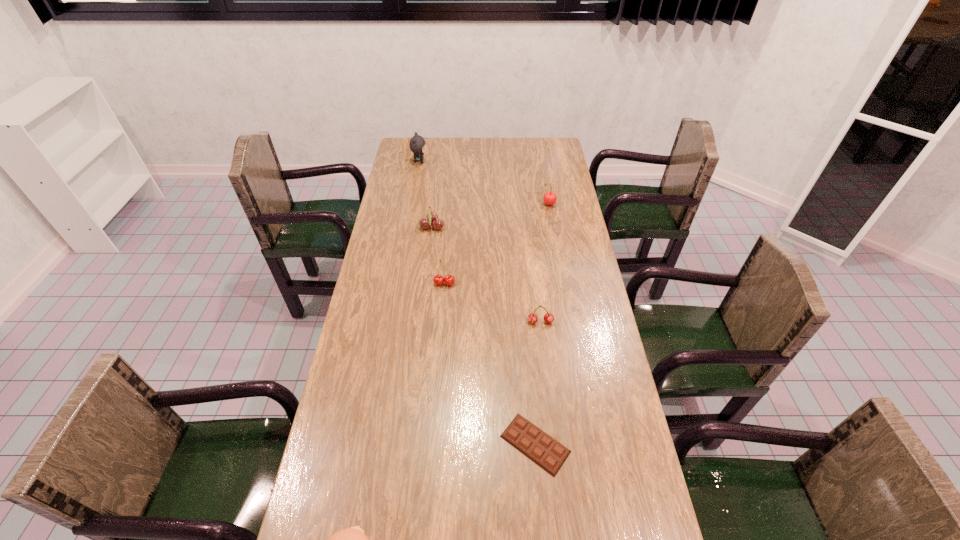
At what (x,y) coordinates should I click in order to perform the action: click on vacant space at the far edge of the desktop. Please return your answer as a coordinate pair (x, y). This screenshot has height=540, width=960. Looking at the image, I should click on (490, 148).

The width and height of the screenshot is (960, 540). What are the coordinates of `free space at the left edge of the desktop` in the screenshot? It's located at (347, 474).

This screenshot has height=540, width=960. I want to click on vacant space at the right edge of the desktop, so click(564, 245).

The image size is (960, 540). In order to click on vacant area that lies between the second farthest cherry and the rightmost object in this screenshot , I will do `click(491, 216)`.

Locate an element on the screen. Image resolution: width=960 pixels, height=540 pixels. empty space that is in between the shortest object and the kitten is located at coordinates (477, 303).

Locate an element on the screen. The height and width of the screenshot is (540, 960). free space between the rightmost object and the fourth nearest object is located at coordinates (496, 244).

What are the coordinates of `vacant area between the third farthest object and the sixth farthest object` in the screenshot? It's located at (484, 335).

At what (x,y) coordinates should I click in order to perform the action: click on vacant space that's between the fourth farthest object and the third farthest object. Please return your answer as a coordinate pair (x, y). Looking at the image, I should click on (439, 255).

Image resolution: width=960 pixels, height=540 pixels. In order to click on unoccupied area between the farthest object and the second farthest object in this screenshot , I will do (x=484, y=183).

Identify the location of free spot between the farthest cherry and the fifth nearest object. (491, 216).